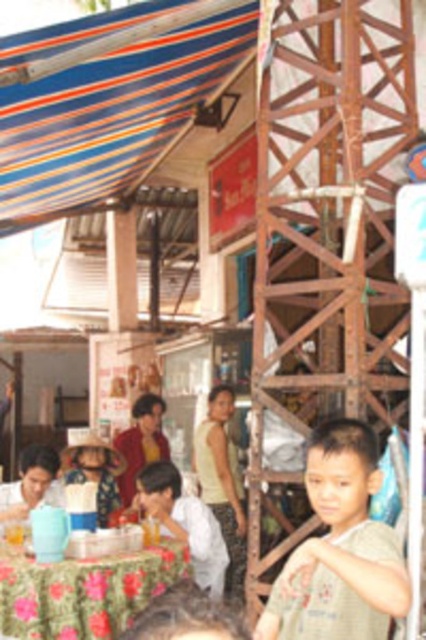
You are a customer at the eatery and want to place your order. You see the floral fabric table at lower left and the white cotton shirt at lower center. Which object is closer to the left side of the image?

The floral fabric table at lower left is closer to the left side of the image because it is positioned to the left of the white cotton shirt at lower center.

You are standing at the point labeled as point (164, 518) and want to move towards the point labeled as point (339, 470). According to the image, will you be moving forward or backward relative to your current position?

Since point (339, 470) is in front of point (164, 518), moving towards it would mean moving forward relative to your current position at point (164, 518).